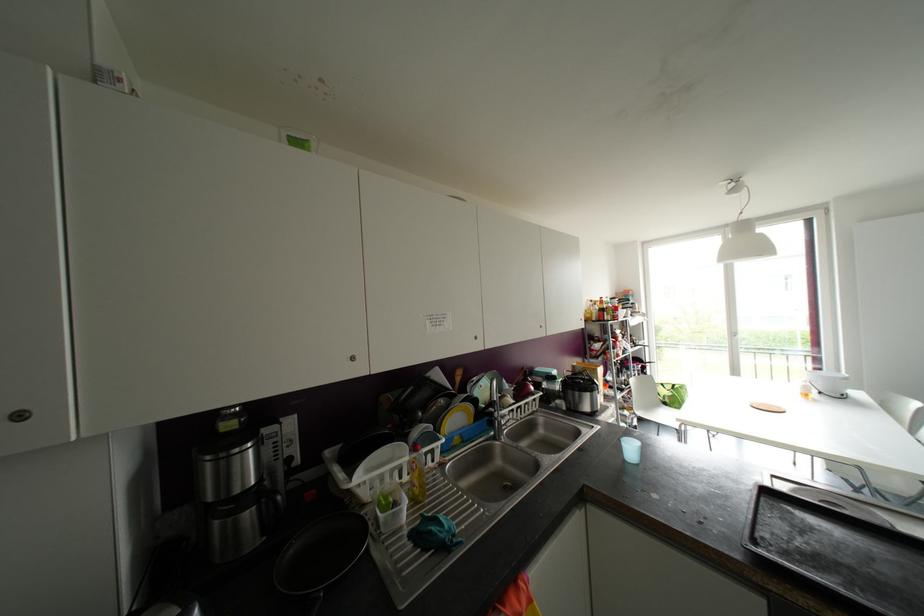
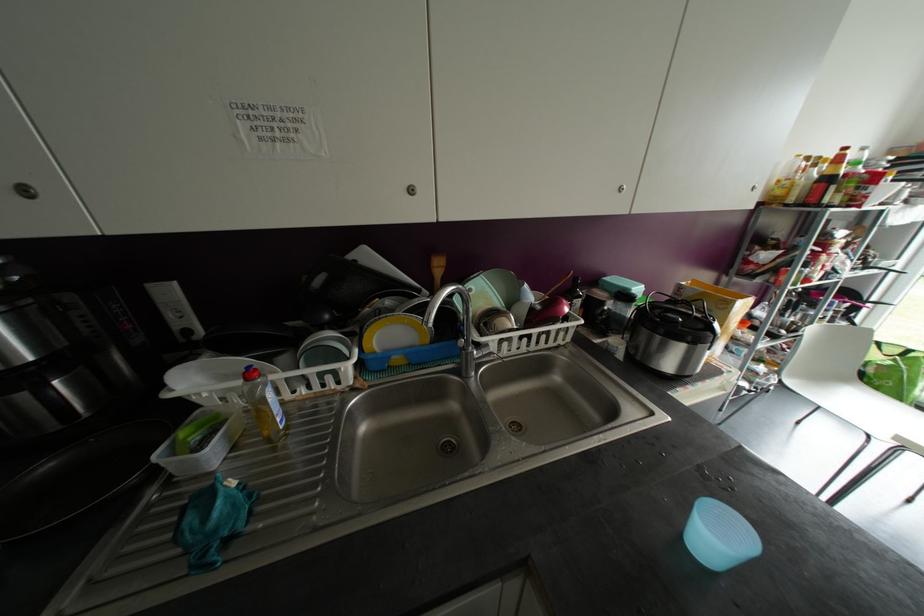
The point at (663, 416) is marked in the first image. Where is the corresponding point in the second image?

(852, 403)